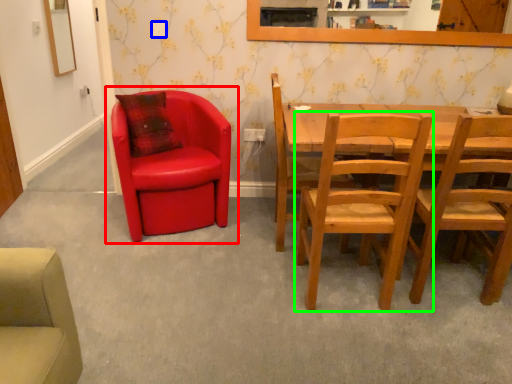
Question: Which object is the closest to the chair (highlighted by a red box)? Choose among these: power outlet (highlighted by a blue box) or chair (highlighted by a green box).

Choices:
 (A) power outlet
 (B) chair

Answer: (A)